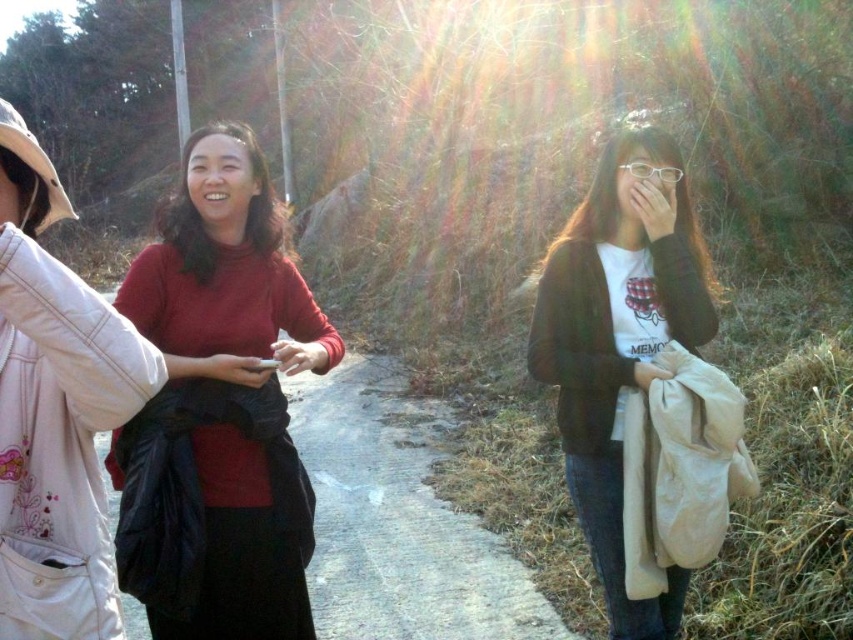
Question: Which point is closer to the camera taking this photo?

Choices:
 (A) (578, 280)
 (B) (328, 364)
 (C) (384, 614)

Answer: (B)

Question: Which is farther from the black fabric bag at center?

Choices:
 (A) matte black cardigan at right
 (B) matte red sweater at center

Answer: (B)

Question: Does matte red sweater at center lie behind black fabric bag at center?

Choices:
 (A) no
 (B) yes

Answer: (A)

Question: Does matte red sweater at center appear over black fabric bag at center?

Choices:
 (A) no
 (B) yes

Answer: (B)

Question: Can you confirm if matte red sweater at center is smaller than matte black cardigan at right?

Choices:
 (A) yes
 (B) no

Answer: (B)

Question: Which point is farther to the camera?

Choices:
 (A) matte red sweater at center
 (B) matte black cardigan at right
 (C) black fabric bag at center

Answer: (C)